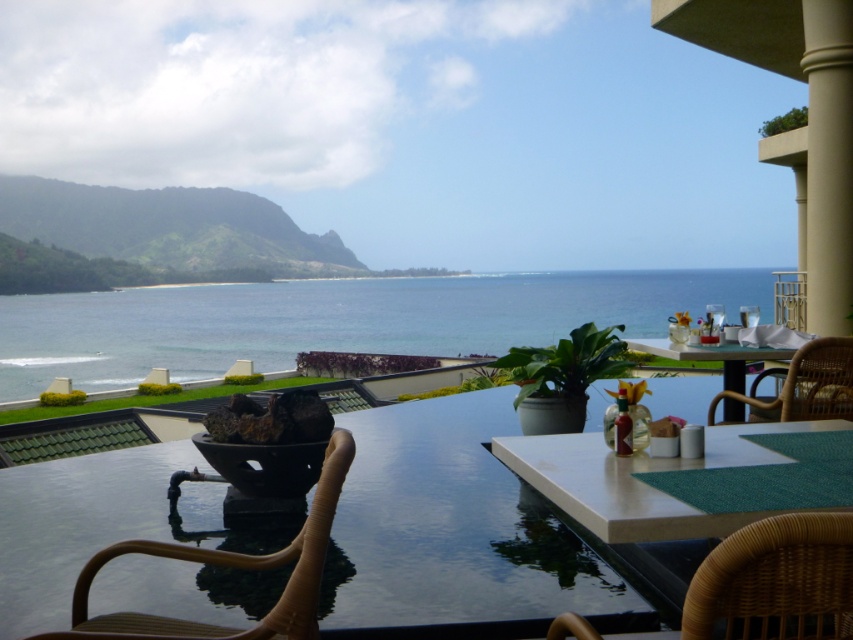
Can you confirm if woven wicker chair at lower right is taller than beige concrete pillar at right?

No, woven wicker chair at lower right is not taller than beige concrete pillar at right.

What are the coordinates of `woven wicker chair at lower right` in the screenshot? It's located at (775, 577).

Does blue water at center appear on the left side of beige concrete pillar at right?

Yes, blue water at center is to the left of beige concrete pillar at right.

Image resolution: width=853 pixels, height=640 pixels. In order to click on blue water at center in this screenshot , I will do [337, 321].

Between point (241, 310) and point (88, 568), which one is positioned in front?

Point (88, 568)

Find the location of a particular element. Image resolution: width=853 pixels, height=640 pixels. blue water at center is located at coordinates (337, 321).